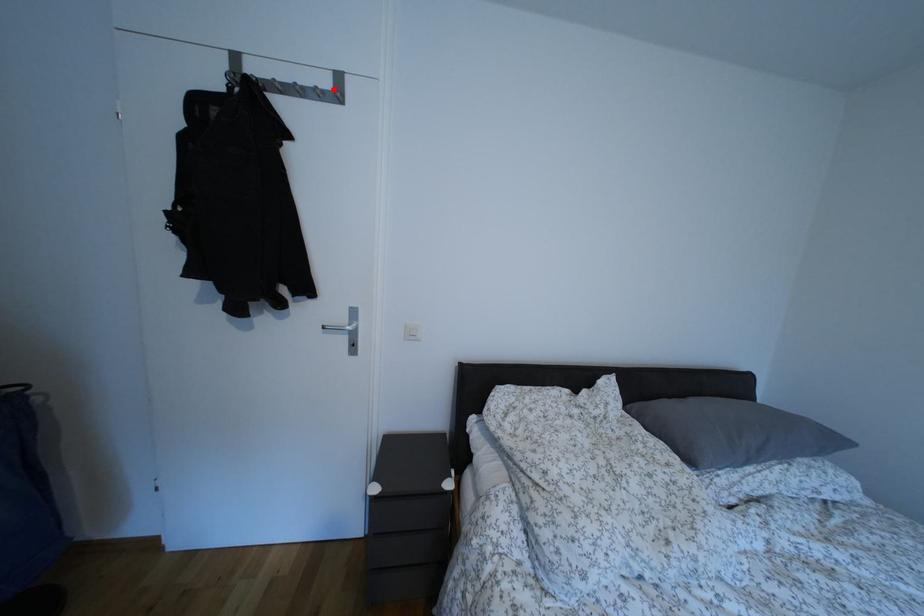
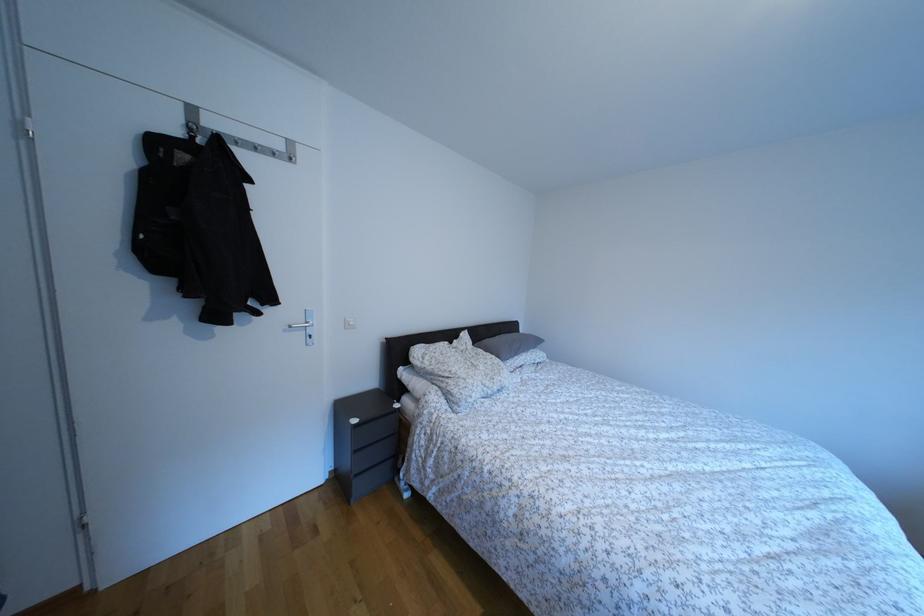
Where in the second image is the point corresponding to the highlighted location from the first image?

(286, 152)